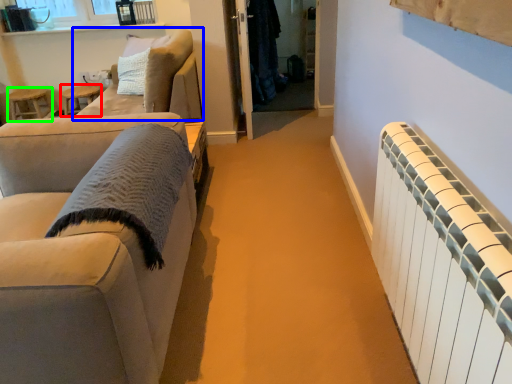
Question: Which is nearer to the side table (highlighted by a red box)? studio couch (highlighted by a blue box) or stool (highlighted by a green box).

Choices:
 (A) studio couch
 (B) stool

Answer: (B)